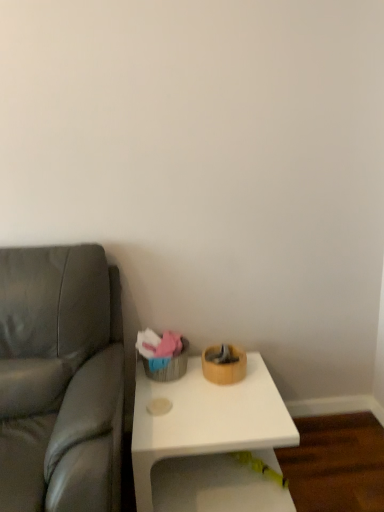
Question: From the image's perspective, would you say suede gray couch at left is shown under white matte table at center?

Choices:
 (A) yes
 (B) no

Answer: (B)

Question: From a real-world perspective, is suede gray couch at left on white matte table at center?

Choices:
 (A) no
 (B) yes

Answer: (B)

Question: Considering the relative sizes of suede gray couch at left and white matte table at center in the image provided, is suede gray couch at left shorter than white matte table at center?

Choices:
 (A) yes
 (B) no

Answer: (B)

Question: Is suede gray couch at left further to camera compared to white matte table at center?

Choices:
 (A) yes
 (B) no

Answer: (B)

Question: Would you say suede gray couch at left is a long distance from white matte table at center?

Choices:
 (A) no
 (B) yes

Answer: (A)

Question: Considering the relative sizes of suede gray couch at left and white matte table at center in the image provided, is suede gray couch at left wider than white matte table at center?

Choices:
 (A) no
 (B) yes

Answer: (B)

Question: Can suede gray couch at left be found inside white matte table at center?

Choices:
 (A) no
 (B) yes

Answer: (A)

Question: Does white matte table at center appear on the left side of suede gray couch at left?

Choices:
 (A) no
 (B) yes

Answer: (A)

Question: Considering the relative sizes of white matte table at center and suede gray couch at left in the image provided, is white matte table at center shorter than suede gray couch at left?

Choices:
 (A) yes
 (B) no

Answer: (A)

Question: Is white matte table at center smaller than suede gray couch at left?

Choices:
 (A) yes
 (B) no

Answer: (A)

Question: Is white matte table at center positioned beyond the bounds of suede gray couch at left?

Choices:
 (A) yes
 (B) no

Answer: (A)

Question: Considering the relative sizes of white matte table at center and suede gray couch at left in the image provided, is white matte table at center taller than suede gray couch at left?

Choices:
 (A) yes
 (B) no

Answer: (B)

Question: In terms of height, does white matte table at center look taller or shorter compared to suede gray couch at left?

Choices:
 (A) short
 (B) tall

Answer: (A)